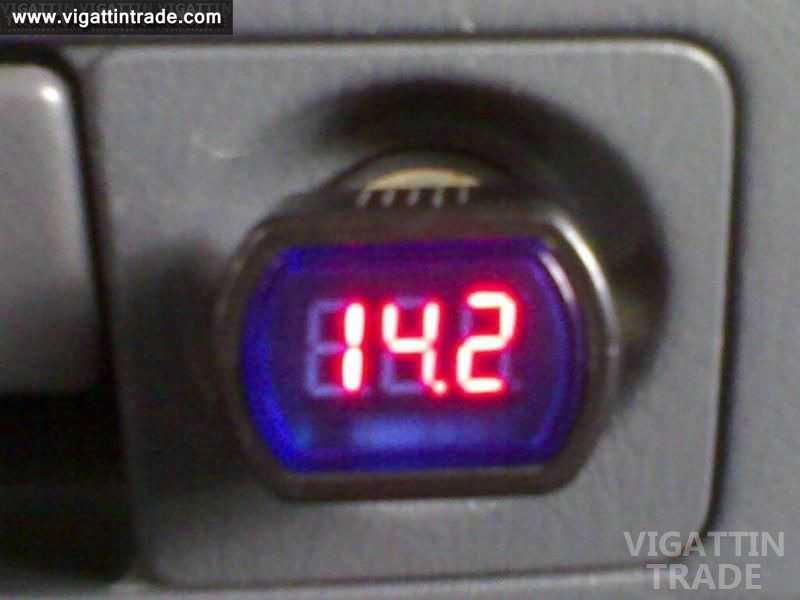
Locate an element on the screen. Image resolution: width=800 pixels, height=600 pixels. rounded corner is located at coordinates (710, 67), (100, 61), (154, 572), (48, 86).